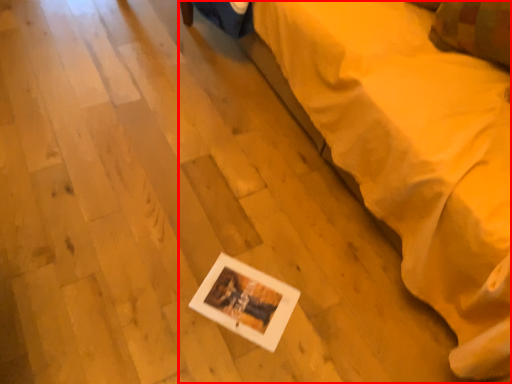
Question: From the image's perspective, where is furniture (annotated by the red box) located in relation to pillow in the image?

Choices:
 (A) below
 (B) above

Answer: (A)